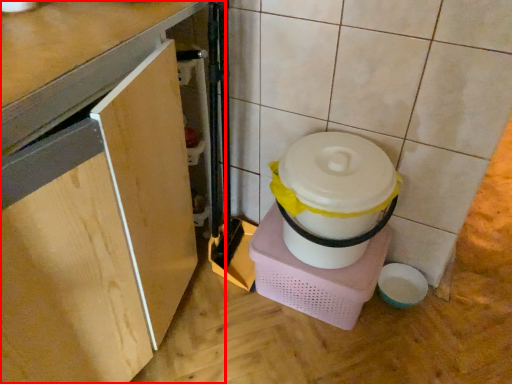
Question: Considering the relative positions of cabinetry (annotated by the red box) and appliance in the image provided, where is cabinetry (annotated by the red box) located with respect to the staircase?

Choices:
 (A) right
 (B) left

Answer: (B)